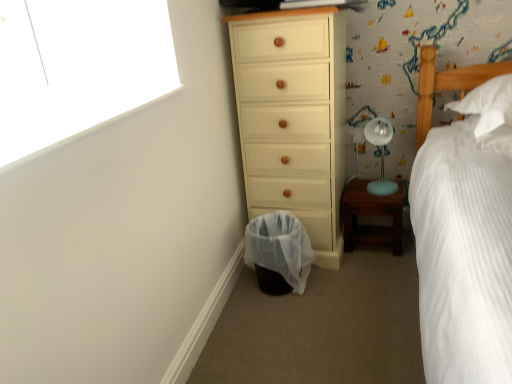
You are a GUI agent. You are given a task and a screenshot of the screen. Output one action in this format:
    pyautogui.click(x=<x>, y=<y>)
    Task: Click on the vacant space behind light blue plastic table lamp at right
    The image size is (512, 384).
    Given the screenshot: What is the action you would take?
    pyautogui.click(x=373, y=179)